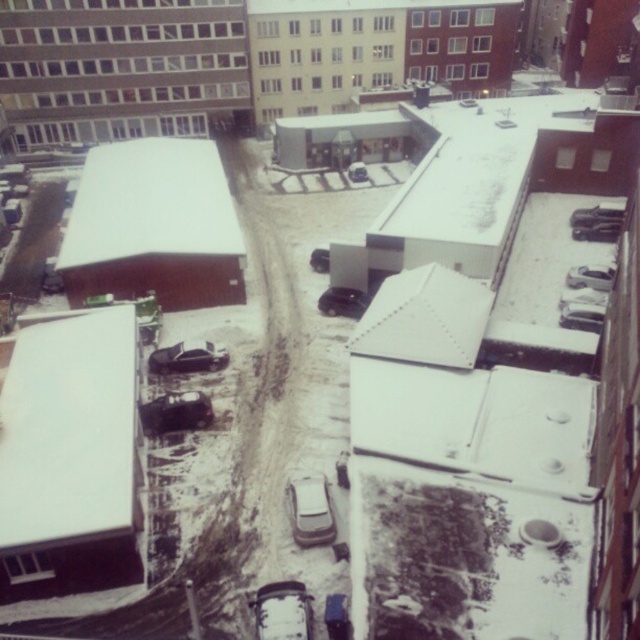
Can you confirm if shiny black car at center is positioned to the right of matte black car at center?

In fact, shiny black car at center is to the left of matte black car at center.

Does shiny black car at center appear on the left side of matte black car at center?

Yes, shiny black car at center is to the left of matte black car at center.

I want to click on shiny black car at center, so click(x=176, y=412).

Does satin black car at center have a lesser width compared to shiny silver sedan at center?

No, satin black car at center is not thinner than shiny silver sedan at center.

The width and height of the screenshot is (640, 640). Describe the element at coordinates (342, 301) in the screenshot. I see `satin black car at center` at that location.

Does point (356, 291) come closer to viewer compared to point (314, 250)?

Yes.

This screenshot has width=640, height=640. What are the coordinates of `satin black car at center` in the screenshot? It's located at (342, 301).

Which is in front, point (275, 605) or point (296, 513)?

Point (275, 605) is in front.

Is white matte car at lower center thinner than white matte car at center?

No, white matte car at lower center is not thinner than white matte car at center.

Is point (250, 600) positioned after point (296, 512)?

No, (250, 600) is closer to viewer.

This screenshot has height=640, width=640. What are the coordinates of `white matte car at lower center` in the screenshot? It's located at (282, 611).